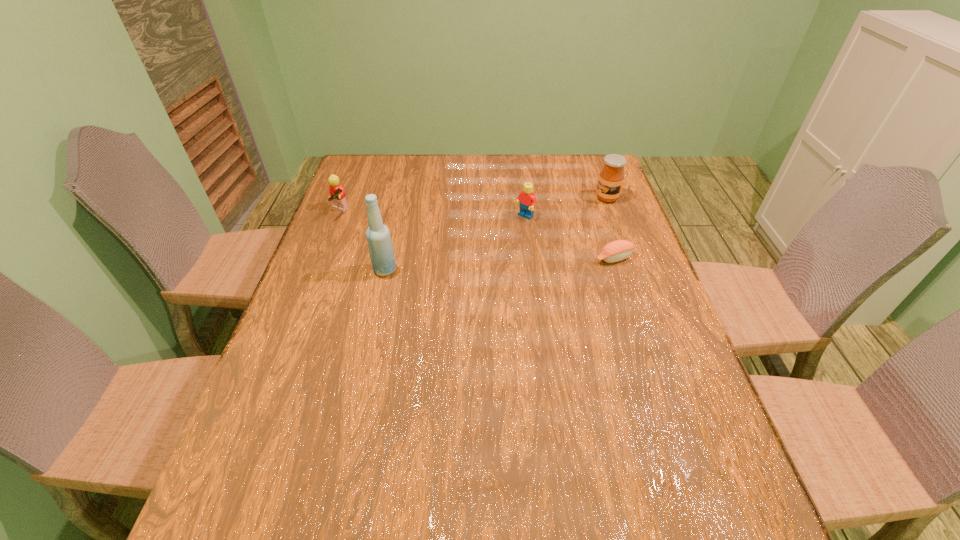
Locate an element on the screen. This screenshot has height=540, width=960. the tallest object is located at coordinates (379, 242).

The image size is (960, 540). What are the coordinates of `the fourth object from right to left` in the screenshot? It's located at (379, 242).

The image size is (960, 540). Identify the location of the shortest object. (618, 250).

Identify the location of the fourth shortest object. The width and height of the screenshot is (960, 540). (611, 177).

Where is `the third object from right to left`? Image resolution: width=960 pixels, height=540 pixels. the third object from right to left is located at coordinates (527, 199).

Locate an element on the screen. This screenshot has width=960, height=540. the left Lego is located at coordinates (337, 194).

Locate an element on the screen. The width and height of the screenshot is (960, 540). free point located on the front of the fourth object from right to left is located at coordinates (368, 345).

Locate an element on the screen. vacant space situated 0.340m on the front of the shortest object is located at coordinates 651,371.

The image size is (960, 540). I want to click on vacant space located on the front-facing side of the honey, so click(570, 219).

The height and width of the screenshot is (540, 960). Find the location of `blank space located 0.220m on the front-facing side of the honey`. blank space located 0.220m on the front-facing side of the honey is located at coordinates (553, 230).